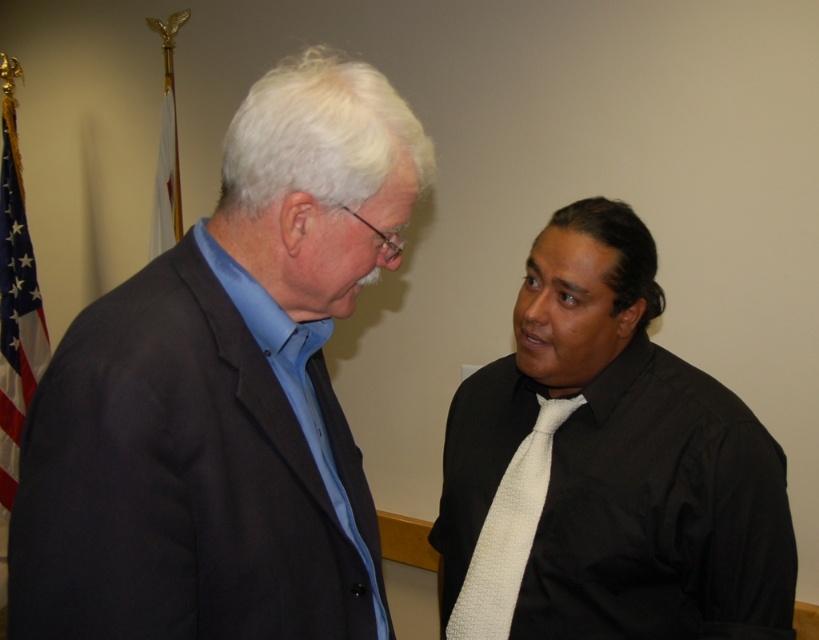
Can you confirm if matte black suit at left is positioned below american flag at left?

Yes.

Which is behind, point (335, 60) or point (0, 304)?

The point (0, 304) is more distant.

Who is more distant from viewer, (50, 481) or (10, 243)?

Point (10, 243)

Identify the location of matte black suit at left. (225, 394).

Is black satin shirt and tie at right in front of blue smooth dress shirt at left?

No, black satin shirt and tie at right is behind blue smooth dress shirt at left.

This screenshot has height=640, width=819. What do you see at coordinates (609, 461) in the screenshot?
I see `black satin shirt and tie at right` at bounding box center [609, 461].

Does point (627, 451) come closer to viewer compared to point (249, 305)?

No, it is behind (249, 305).

The image size is (819, 640). Identify the location of black satin shirt and tie at right. (609, 461).

Can you confirm if blue smooth dress shirt at left is positioned to the right of american flag at left?

Yes, blue smooth dress shirt at left is to the right of american flag at left.

Is point (374, 588) less distant than point (7, 220)?

Yes, it is in front of point (7, 220).

I want to click on blue smooth dress shirt at left, so click(292, 384).